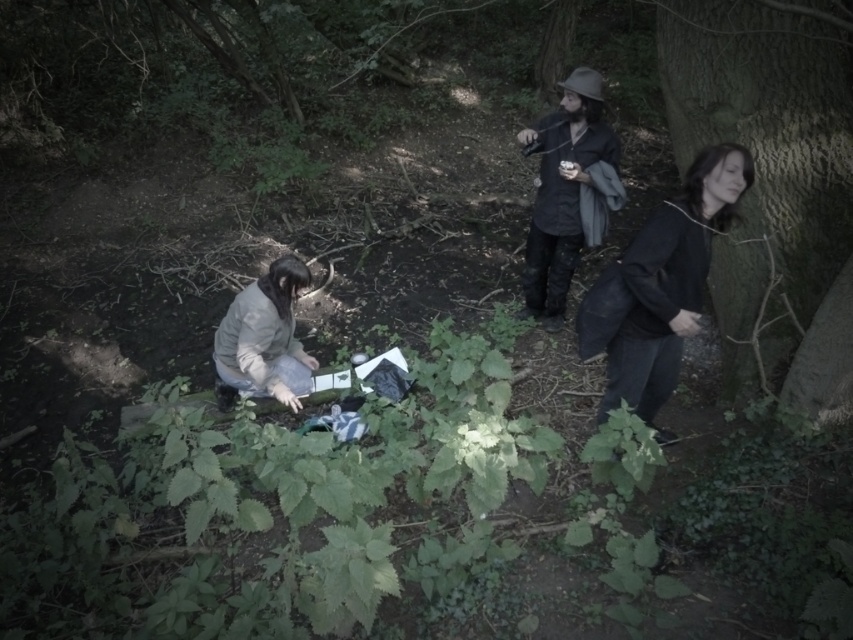
Question: Which object appears closest to the camera in this image?

Choices:
 (A) black matte shirt at center
 (B) dark gray fabric jacket at right

Answer: (B)

Question: From the image, what is the correct spatial relationship of smooth bark tree at right in relation to dark gray fabric jacket at right?

Choices:
 (A) below
 (B) above

Answer: (B)

Question: Estimate the real-world distances between objects in this image. Which object is farther from the dark gray fabric jacket at right?

Choices:
 (A) black matte shirt at center
 (B) smooth bark tree at right

Answer: (A)

Question: Is black matte shirt at center further to camera compared to light gray fabric at lower left?

Choices:
 (A) yes
 (B) no

Answer: (A)

Question: Can you confirm if dark gray fabric jacket at right is positioned to the right of black matte shirt at center?

Choices:
 (A) no
 (B) yes

Answer: (B)

Question: Which point is closer to the camera taking this photo?

Choices:
 (A) (704, 36)
 (B) (225, 339)

Answer: (B)